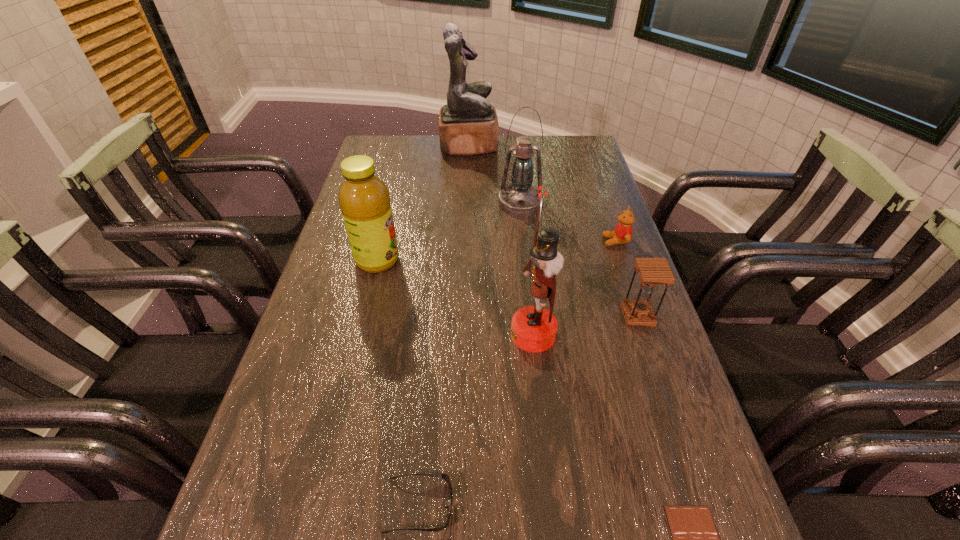
You are a GUI agent. You are given a task and a screenshot of the screen. Output one action in this format:
    pyautogui.click(x=<x>, y=<y>)
    Task: Click on the vacant space that's between the seventh nearest object and the leftmost object
    This screenshot has height=540, width=960.
    Given the screenshot: What is the action you would take?
    click(449, 232)

Where is `vacant space that is in between the fifth tallest object and the leftmost object`? The image size is (960, 540). vacant space that is in between the fifth tallest object and the leftmost object is located at coordinates (508, 288).

Where is `unoccupied area between the seventh nearest object and the sixth tallest object`? Image resolution: width=960 pixels, height=540 pixels. unoccupied area between the seventh nearest object and the sixth tallest object is located at coordinates (568, 222).

I want to click on unoccupied position between the nutcracker and the fifth tallest object, so point(586,325).

In order to click on vacant area between the oil lamp and the sculpture in this screenshot , I will do `click(494, 174)`.

Point out which object is positioned as the second nearest to the second farthest object. Please provide its 2D coordinates. Your answer should be formatted as a tuple, i.e. [(x, y)], where the tuple contains the x and y coordinates of a point satisfying the conditions above.

[(468, 125)]

Identify which object is located as the sixth nearest to the fourth shortest object. Please provide its 2D coordinates. Your answer should be formatted as a tuple, i.e. [(x, y)], where the tuple contains the x and y coordinates of a point satisfying the conditions above.

[(364, 199)]

Where is `free location that satisfies the following two spatial constraints: 1. on the front side of the seventh nearest object; 2. on the front label of the leftmost object`? The width and height of the screenshot is (960, 540). free location that satisfies the following two spatial constraints: 1. on the front side of the seventh nearest object; 2. on the front label of the leftmost object is located at coordinates (527, 260).

You are a GUI agent. You are given a task and a screenshot of the screen. Output one action in this format:
    pyautogui.click(x=<x>, y=<y>)
    Task: Click on the vacant area that satisfies the following two spatial constraints: 1. on the front side of the hourglass; 2. on the front-facing side of the nutcracker
    The height and width of the screenshot is (540, 960).
    Given the screenshot: What is the action you would take?
    pyautogui.click(x=644, y=334)